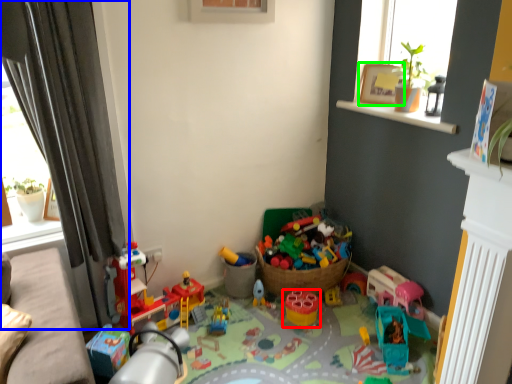
Question: Which object is the closest to the toy (highlighted by a red box)? Choose among these: curtain (highlighted by a blue box) or picture frame (highlighted by a green box).

Choices:
 (A) curtain
 (B) picture frame

Answer: (B)